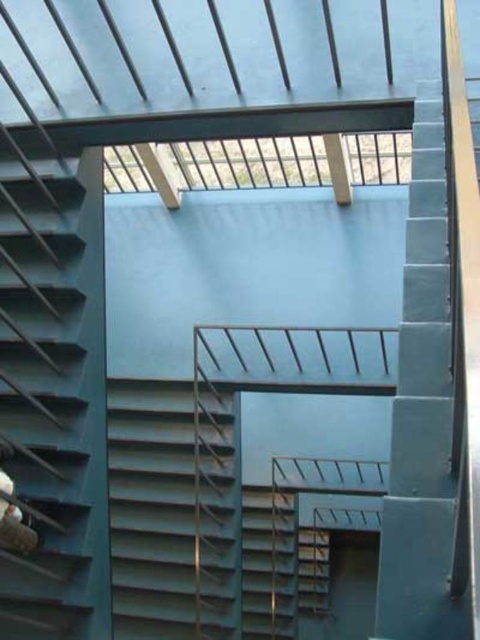
You are standing at the base of the structure and want to reach the horizontal metal beam above the metallic gray stairs at center. Which direction should you move relative to the stairs to reach the beam?

The horizontal metal beam is above the metallic gray stairs at center, so you should move upward from the stairs to reach the beam.

From the picture: You are standing at the base of the teal steps in the image and want to take a photo of the point at coordinates (11, 266). If your camera is 5 feet tall, will you be able to capture the point in your photo without moving your position?

The point at coordinates (11, 266) is 8.68 feet away from the camera. Since the camera is 5 feet tall, it is possible to capture the point in the photo as long as the camera is angled appropriately to account for the distance and height difference.

You are a maintenance worker needing to inspect the space between the metallic gray stairs at center and the metallic gray stair at center. Can you fit through the gap if your tool box is 1.4 meters wide?

The distance between the metallic gray stairs at center and the metallic gray stair at center is 1.41 meters, so the tool box with 1.4 meters width can fit through the gap since it is slightly narrower than the available space.